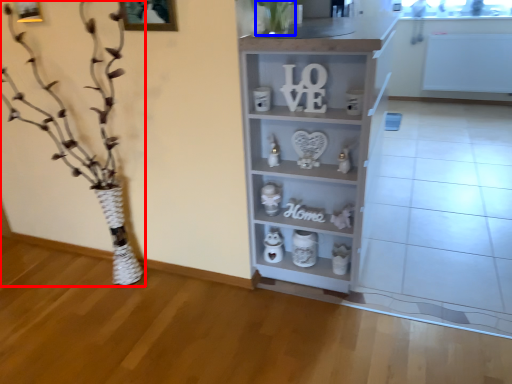
Question: Which point is further to the camera, floral arrangement (highlighted by a red box) or plant (highlighted by a blue box)?

Choices:
 (A) floral arrangement
 (B) plant

Answer: (B)